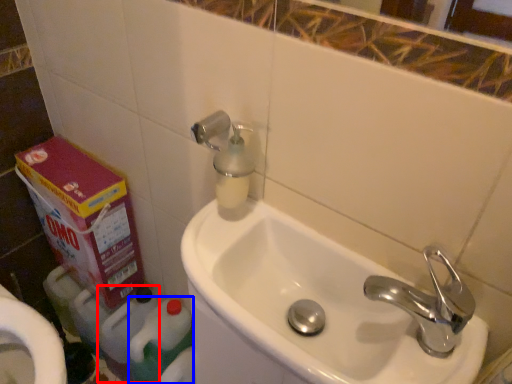
Question: Which object appears closest to the camera in this image, cleaning product (highlighted by a red box) or cleaning product (highlighted by a blue box)?

Choices:
 (A) cleaning product
 (B) cleaning product

Answer: (B)